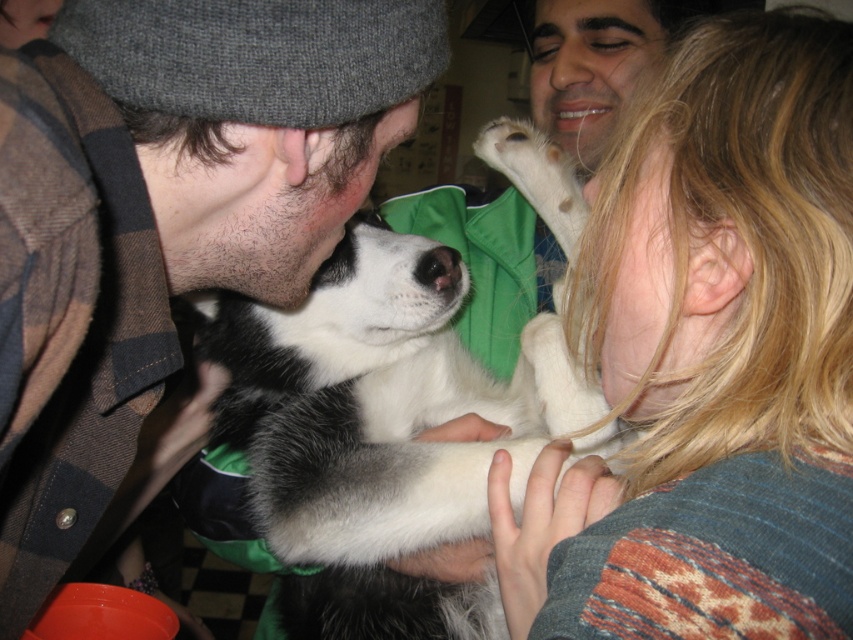
Question: Which point appears farthest from the camera in this image?

Choices:
 (A) (366, 404)
 (B) (695, 468)

Answer: (A)

Question: Can you confirm if fluffy gray hat at upper left is thinner than black and white fur at center?

Choices:
 (A) no
 (B) yes

Answer: (B)

Question: Which point is farther from the camera taking this photo?

Choices:
 (A) (405, 243)
 (B) (767, 128)
 (C) (572, 86)

Answer: (C)

Question: Is blonde hair at upper right bigger than fluffy gray hat at upper left?

Choices:
 (A) no
 (B) yes

Answer: (A)

Question: Is fluffy gray hat at upper left below black and white fur at center?

Choices:
 (A) no
 (B) yes

Answer: (A)

Question: Which of the following is the farthest from the observer?

Choices:
 (A) fluffy gray hat at upper left
 (B) black and white fur at center
 (C) matte skin nose at center
 (D) blonde hair at upper right

Answer: (C)